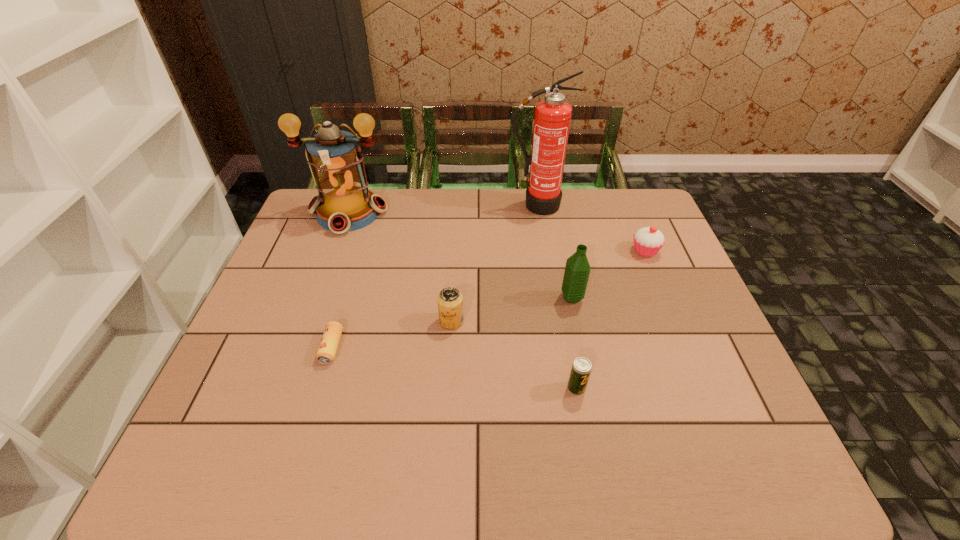
The image size is (960, 540). I want to click on the shortest object, so click(328, 346).

Locate an element on the screen. the leftmost beer can is located at coordinates (328, 346).

Where is `free region located on the front-facing side of the fire extinguisher`? This screenshot has height=540, width=960. free region located on the front-facing side of the fire extinguisher is located at coordinates (540, 231).

The image size is (960, 540). In order to click on vacant area located on the front-facing side of the second tallest object in this screenshot , I will do 329,266.

The image size is (960, 540). Find the location of `vacant point located on the front of the water bottle`. vacant point located on the front of the water bottle is located at coordinates (587, 370).

The image size is (960, 540). I want to click on free space located 0.120m on the back of the third object from left to right, so click(454, 279).

The width and height of the screenshot is (960, 540). What are the coordinates of `vacant area situated 0.060m on the front of the rightmost object` in the screenshot? It's located at (655, 275).

Image resolution: width=960 pixels, height=540 pixels. What are the coordinates of `vacant region located on the front of the nearest beer can` in the screenshot? It's located at (588, 455).

Find the location of a particular element. The height and width of the screenshot is (540, 960). vacant space located 0.120m on the back of the shortest object is located at coordinates (348, 295).

You are a GUI agent. You are given a task and a screenshot of the screen. Output one action in this format:
    pyautogui.click(x=<x>, y=<y>)
    Task: Click on the fire extinguisher present at the far edge
    
    Given the screenshot: What is the action you would take?
    click(x=552, y=118)